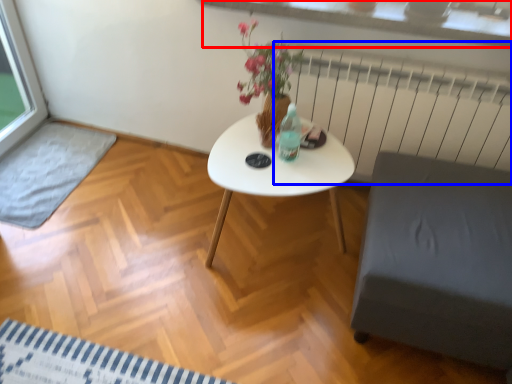
Question: Among these objects, which one is nearest to the camera, window sill (highlighted by a red box) or radiator (highlighted by a blue box)?

Choices:
 (A) window sill
 (B) radiator

Answer: (A)